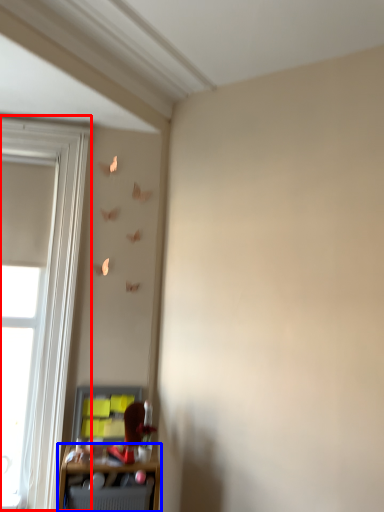
Question: Among these objects, which one is nearest to the camera, window (highlighted by a red box) or shelf (highlighted by a blue box)?

Choices:
 (A) window
 (B) shelf

Answer: (B)